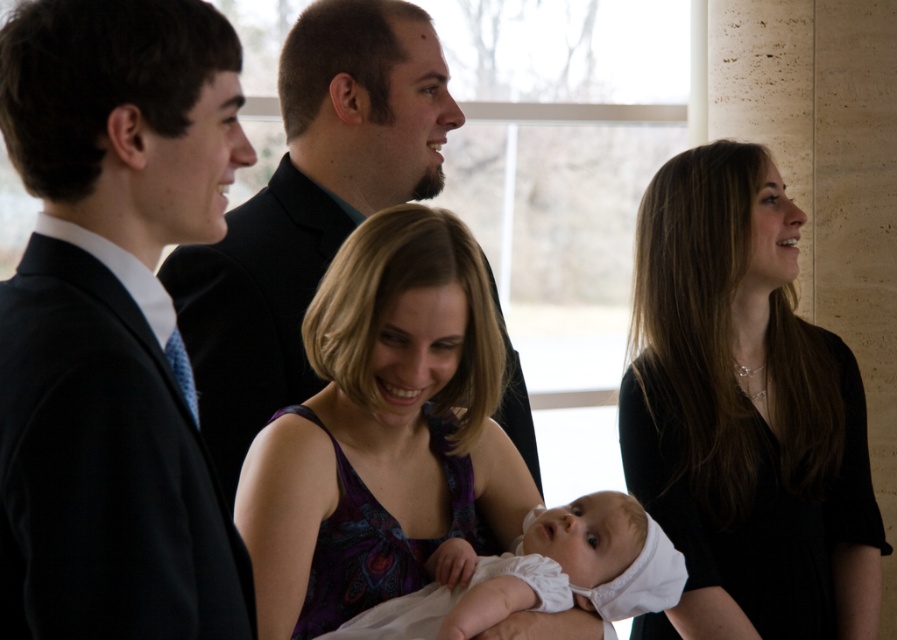
You are a photographer at a formal event. You notice the matte black suit at center and the white soft fabric baby at center. Which object is covering the other in the image?

The matte black suit at center is positioned over the white soft fabric baby at center, so it is covering the baby.

You are a photographer setting up for a group photo. You need to ensure that the purple satin dress at center and the white soft fabric baby at center are both visible in the frame. Given their heights, which one might require adjusting the camera angle to capture properly?

The purple satin dress at center is taller than the white soft fabric baby at center, so the camera angle may need to be lowered to ensure the taller dress is fully captured while keeping the baby in view.

You are a photographer at a formal event. You need to position a spotlight on the purple satin dress at center and matte black suit at center. Since both are at the center, how do you determine which one to place the spotlight closer to?

The purple satin dress at center is in front of matte black suit at center, so the spotlight should be placed closer to the purple satin dress at center to highlight the foreground object.